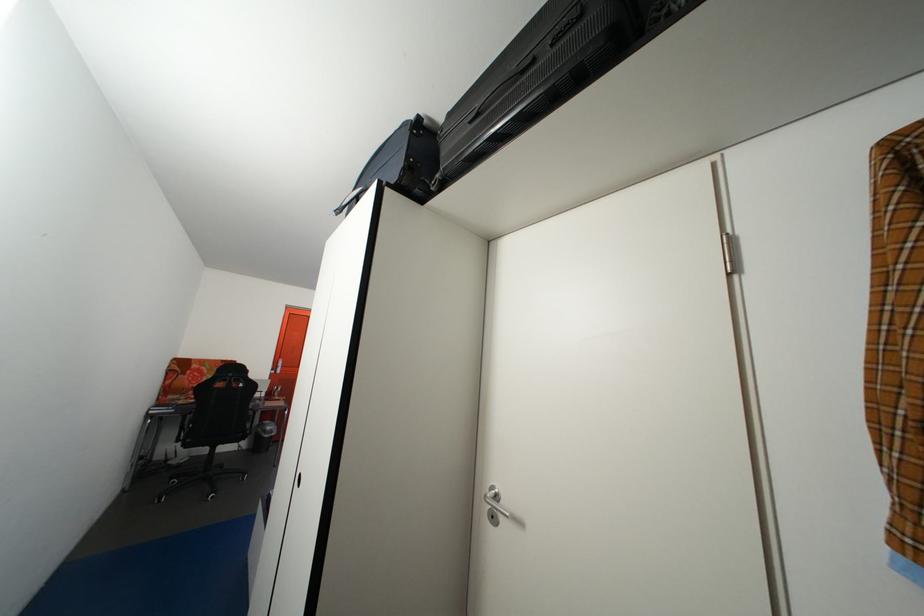
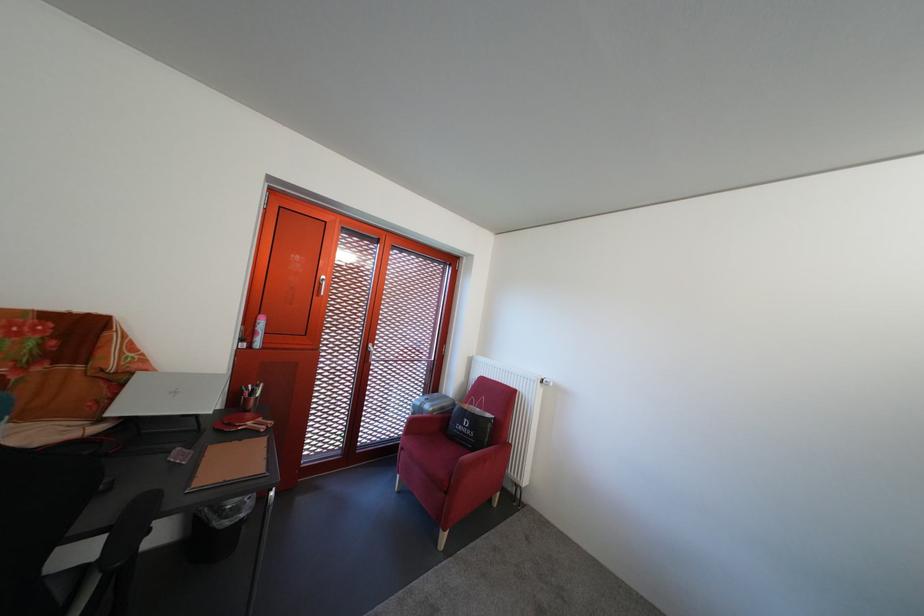
In a continuous first-person perspective shot, in which direction is the camera moving?

The cameraman moved toward left, forward.